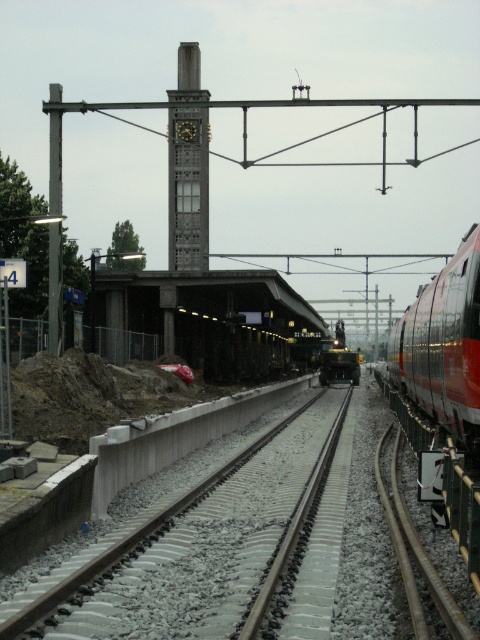
Between point (142, 536) and point (354, 380), which one is positioned in front?

Positioned in front is point (142, 536).

Is point (75, 628) more distant than point (322, 364)?

That is False.

Is point (309, 593) more distant than point (338, 332)?

No, it is not.

Identify the location of gray concrete train track at center. The height and width of the screenshot is (640, 480). (213, 548).

Can you confirm if concrete platform at center is thinner than red glossy train at right?

No.

Is point (211, 316) less distant than point (417, 380)?

No, (211, 316) is behind (417, 380).

Is point (289, 349) less distant than point (478, 305)?

No, it is not.

Where is `concrete platform at center`? This screenshot has height=640, width=480. concrete platform at center is located at coordinates (211, 321).

Can you confirm if concrete platform at center is thinner than shiny metallic train at center?

No.

How far apart are concrete platform at center and shiny metallic train at center?

They are 9.68 meters apart.

What are the coordinates of `concrete platform at center` in the screenshot? It's located at (211, 321).